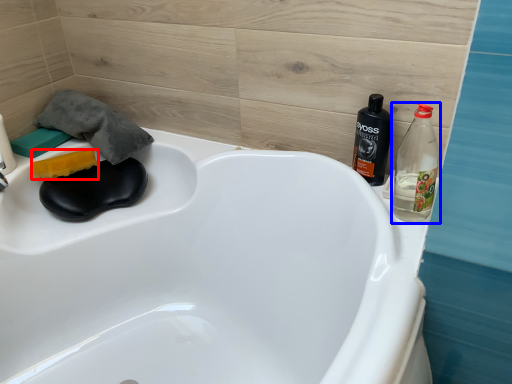
Question: Which object is further to the camera taking this photo, soap (highlighted by a red box) or bottle (highlighted by a blue box)?

Choices:
 (A) soap
 (B) bottle

Answer: (A)